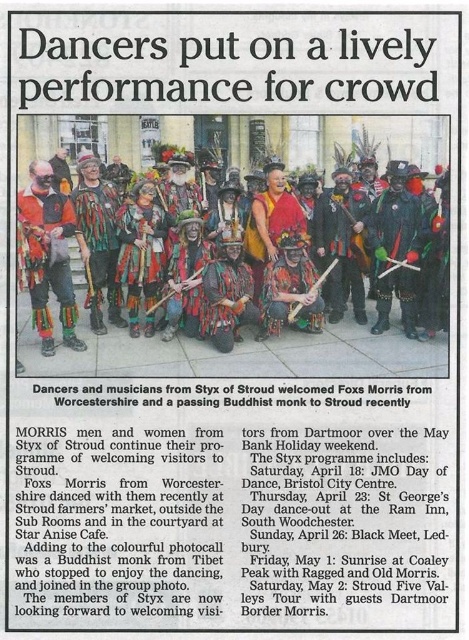
Looking at this image, is matte multicolored costume at center to the left of orange fabric mask at left from the viewer's perspective?

Incorrect, matte multicolored costume at center is not on the left side of orange fabric mask at left.

Which is in front, point (24, 320) or point (32, 234)?

Point (32, 234)

What do you see at coordinates (347, 348) in the screenshot? I see `matte multicolored costume at center` at bounding box center [347, 348].

Where is `matte multicolored costume at center`? matte multicolored costume at center is located at coordinates (347, 348).